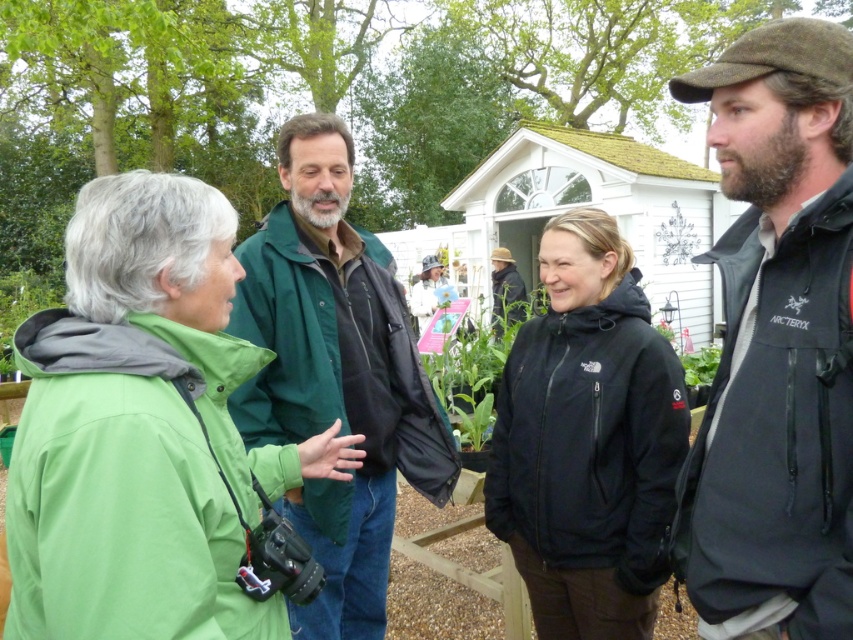
Which of these two, green softshell jacket at left or dark brown leather jacket at center, stands shorter?

green softshell jacket at left is shorter.

Describe the element at coordinates (144, 429) in the screenshot. I see `green softshell jacket at left` at that location.

This screenshot has width=853, height=640. What do you see at coordinates (144, 429) in the screenshot?
I see `green softshell jacket at left` at bounding box center [144, 429].

Identify the location of green softshell jacket at left. [x=144, y=429].

Which is below, green leafy plant at upper left or dark brown leather jacket at center?

green leafy plant at upper left is lower down.

Between point (45, 304) and point (514, 316), which one is positioned behind?

The point (45, 304) is more distant.

The width and height of the screenshot is (853, 640). Identify the location of green leafy plant at upper left. (22, 305).

Does green softshell jacket at left appear on the left side of dark brown wool cap at upper right?

Correct, you'll find green softshell jacket at left to the left of dark brown wool cap at upper right.

Which is in front, point (91, 269) or point (805, 208)?

Point (91, 269)

Where is `green softshell jacket at left`? green softshell jacket at left is located at coordinates (144, 429).